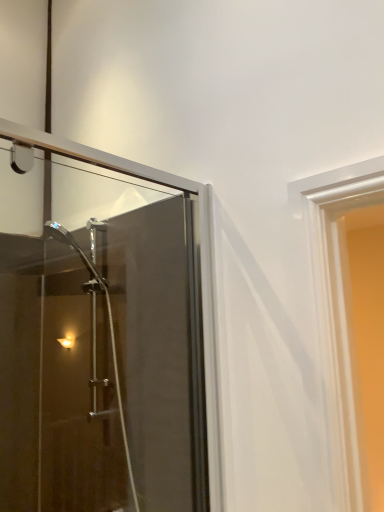
Describe the element at coordinates (142, 318) in the screenshot. The width and height of the screenshot is (384, 512). I see `transparent glass shower at left` at that location.

Image resolution: width=384 pixels, height=512 pixels. I want to click on transparent glass shower at left, so click(142, 318).

At what (x,y) coordinates should I click in order to perform the action: click on transparent glass shower at left. Please return your answer as a coordinate pair (x, y). This screenshot has width=384, height=512. Looking at the image, I should click on (142, 318).